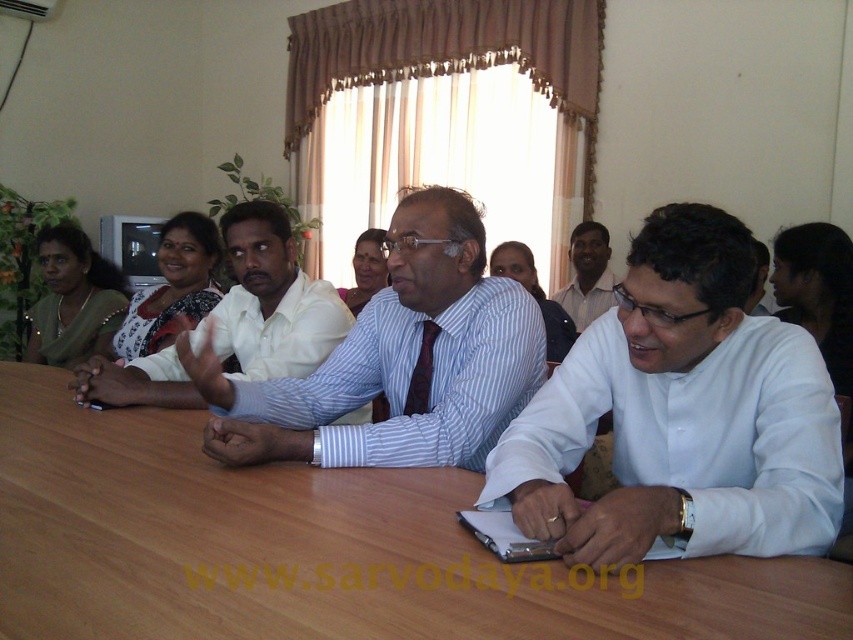
Based on the photo, you are a photographer standing 2 feet away from the blue striped shirt at center and the striped cotton shirt at center. You want to take a photo that includes both shirts without moving the subjects. Can you fit both shirts into the frame if your camera has a maximum field of view of 20 inches?

The blue striped shirt at center is 18.68 inches away from the striped cotton shirt at center. Since the distance between them is less than the camera field of view of 20 inches, both shirts can be captured in the frame without moving the subjects.

You are attending a meeting and need to pass a document to the person in the white shirt at center without disturbing the person in the blue striped shirt at center. Which direction should you approach from?

The blue striped shirt at center is positioned on the left side of white shirt at center. To avoid disturbing the person in the blue striped shirt at center, you should approach from the right side of the white shirt at center.

You are a photographer standing behind the brown wooden table at center. You want to take a photo of the striped cotton shirt at center without any obstructions. Since you can only move forward or backward along the line connecting you to the shirt, will you be able to get a clear shot? Explain your reasoning based on the distance provided.

The brown wooden table at center is only 19.09 inches away from the striped cotton shirt at center. Since the table is between you and the shirt, moving forward would bring you closer to the table, potentially blocking the view. Moving backward would increase the distance but might still leave the table obstructing the shot. Given the short distance between the table and the shirt, it is likely that the table would block the view unless you can position yourself far enough back to see over or around it. The